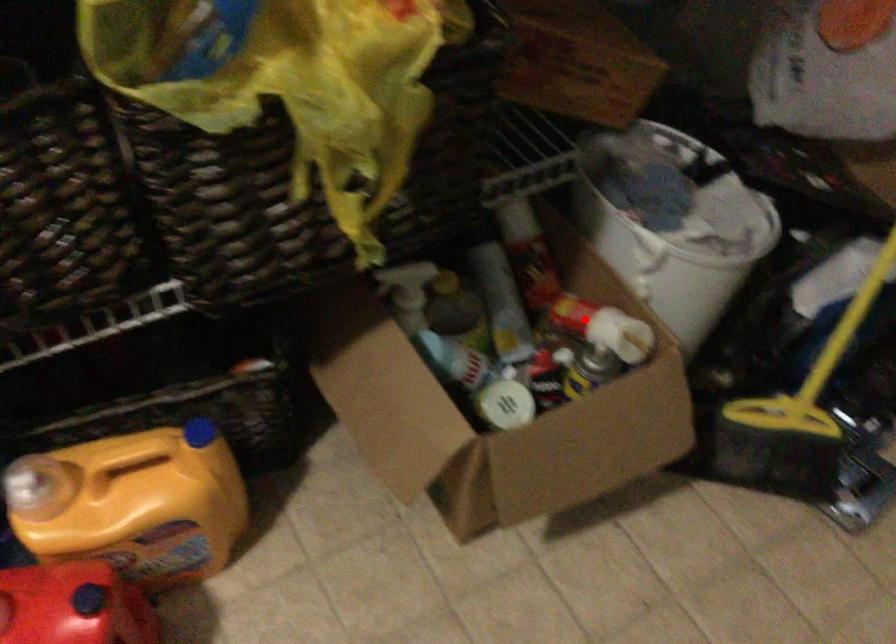
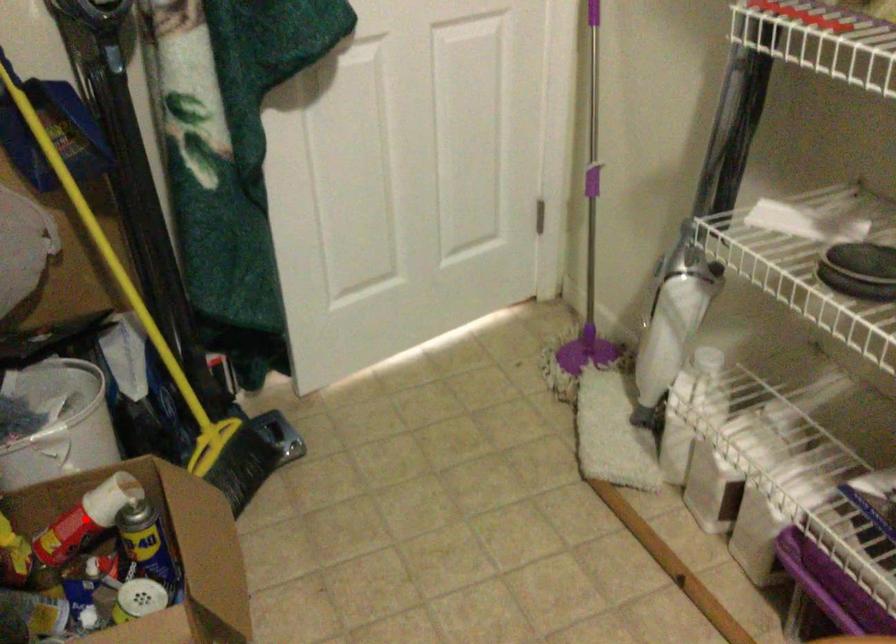
I am providing you with two images of the same scene from different viewpoints. A red point is marked on the first image and another point is marked on the second image. Is the red point in image1 aligned with the point shown in image2?

Yes